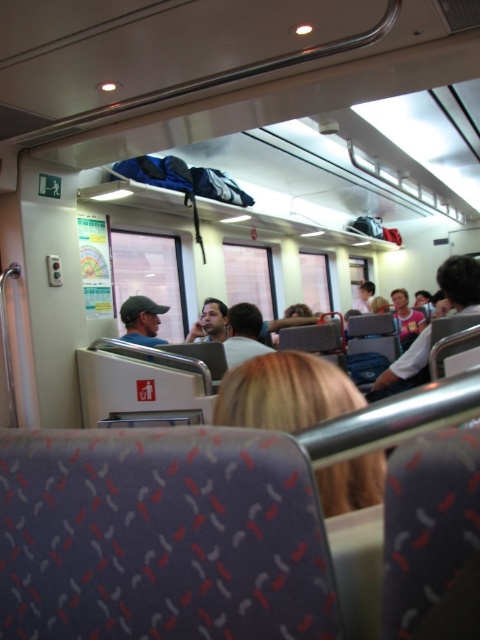
You are a passenger on the train and you want to know if the space between the blonde hair at center and the matte pink shirt at center is enough for you to pass through. Can you go through the space?

The blonde hair at center is thinner than the matte pink shirt at center, so the space between them is sufficient for you to pass through.

You are a passenger sitting in the train carriage and you want to know if the blonde hair at center is shorter than the matte pink shirt at center. Can you determine this based on their positions?

The blonde hair at center has a lesser height compared to matte pink shirt at center, so yes, the blonde hair at center is shorter than the matte pink shirt at center.